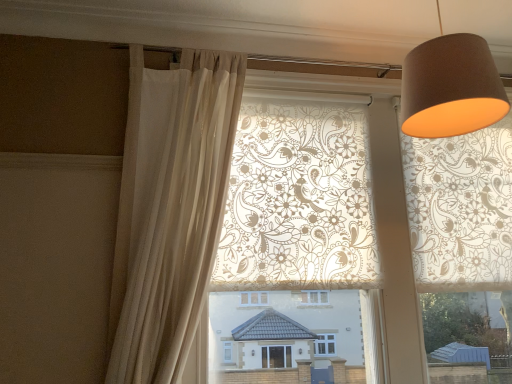
Identify the location of matte brown lampshade at upper right. (451, 88).

Describe the element at coordinates (451, 88) in the screenshot. Image resolution: width=512 pixels, height=384 pixels. I see `matte brown lampshade at upper right` at that location.

What do you see at coordinates (170, 208) in the screenshot? This screenshot has height=384, width=512. I see `sheer beige curtain at left` at bounding box center [170, 208].

In order to click on sheer beige curtain at left in this screenshot , I will do `click(170, 208)`.

What are the coordinates of `matte brown lampshade at upper right` in the screenshot? It's located at (451, 88).

Can you confirm if sheer beige curtain at left is positioned to the left of matte brown lampshade at upper right?

Yes, sheer beige curtain at left is to the left of matte brown lampshade at upper right.

Which is behind, sheer beige curtain at left or matte brown lampshade at upper right?

sheer beige curtain at left.

Consider the image. Which is closer, (149, 149) or (412, 115)?

Clearly, point (149, 149) is more distant from the camera than point (412, 115).

From the image's perspective, between sheer beige curtain at left and matte brown lampshade at upper right, who is located below?

sheer beige curtain at left, from the image's perspective.

From a real-world perspective, who is located higher, sheer beige curtain at left or matte brown lampshade at upper right?

matte brown lampshade at upper right, from a real-world perspective.

Looking at their sizes, would you say sheer beige curtain at left is wider or thinner than matte brown lampshade at upper right?

Considering their sizes, sheer beige curtain at left looks slimmer than matte brown lampshade at upper right.

Is sheer beige curtain at left taller than matte brown lampshade at upper right?

Yes.

Between sheer beige curtain at left and matte brown lampshade at upper right, which one has larger size?

sheer beige curtain at left.

From the picture: Is matte brown lampshade at upper right located within sheer beige curtain at left?

No, matte brown lampshade at upper right is not inside sheer beige curtain at left.

Is sheer beige curtain at left far away from matte brown lampshade at upper right?

That's not correct — sheer beige curtain at left is a little close to matte brown lampshade at upper right.

Is sheer beige curtain at left oriented away from matte brown lampshade at upper right?

No, matte brown lampshade at upper right is not at the back of sheer beige curtain at left.

How different are the orientations of sheer beige curtain at left and matte brown lampshade at upper right in degrees?

They differ by 0.706 degrees in their facing directions.

Measure the distance between sheer beige curtain at left and matte brown lampshade at upper right.

35.23 inches.

Identify the location of table lamp on the right of sheer beige curtain at left. This screenshot has width=512, height=384. (451, 88).

Considering the positions of objects matte brown lampshade at upper right and sheer beige curtain at left in the image provided, who is more to the left, matte brown lampshade at upper right or sheer beige curtain at left?

From the viewer's perspective, sheer beige curtain at left appears more on the left side.

Is matte brown lampshade at upper right further to camera compared to sheer beige curtain at left?

No, the depth of matte brown lampshade at upper right is less than that of sheer beige curtain at left.

Does point (473, 68) lie behind point (166, 133)?

No, (473, 68) is in front of (166, 133).

In the scene shown: From the image's perspective, is matte brown lampshade at upper right located above or below sheer beige curtain at left?

Clearly, from the image's perspective, matte brown lampshade at upper right is above sheer beige curtain at left.

From a real-world perspective, who is located lower, matte brown lampshade at upper right or sheer beige curtain at left?

sheer beige curtain at left is physically lower.

In terms of width, does matte brown lampshade at upper right look wider or thinner when compared to sheer beige curtain at left?

Clearly, matte brown lampshade at upper right has more width compared to sheer beige curtain at left.

Considering the relative sizes of matte brown lampshade at upper right and sheer beige curtain at left in the image provided, is matte brown lampshade at upper right taller than sheer beige curtain at left?

No, matte brown lampshade at upper right is not taller than sheer beige curtain at left.

Is matte brown lampshade at upper right bigger or smaller than sheer beige curtain at left?

Considering their sizes, matte brown lampshade at upper right takes up less space than sheer beige curtain at left.

Could sheer beige curtain at left be considered to be inside matte brown lampshade at upper right?

No, matte brown lampshade at upper right does not contain sheer beige curtain at left.

Is the surface of matte brown lampshade at upper right in direct contact with sheer beige curtain at left?

matte brown lampshade at upper right and sheer beige curtain at left are not in contact.

Is matte brown lampshade at upper right oriented away from sheer beige curtain at left?

No, matte brown lampshade at upper right's orientation is not away from sheer beige curtain at left.

Locate an element on the screen. This screenshot has width=512, height=384. curtain located behind the matte brown lampshade at upper right is located at coordinates [170, 208].

Image resolution: width=512 pixels, height=384 pixels. Find the location of `table lamp in front of the sheer beige curtain at left`. table lamp in front of the sheer beige curtain at left is located at coordinates 451,88.

Locate an element on the screen. This screenshot has height=384, width=512. curtain located below the matte brown lampshade at upper right (from the image's perspective) is located at coordinates (170, 208).